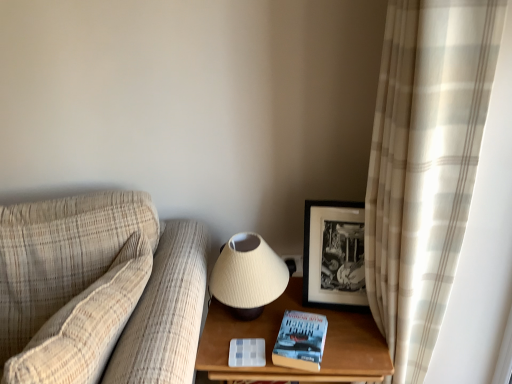
At what (x,y) coordinates should I click in order to perform the action: click on vacant space that is to the left of hardcover blue book at lower right. Please return your answer as a coordinate pair (x, y). This screenshot has width=512, height=384. Looking at the image, I should click on (244, 336).